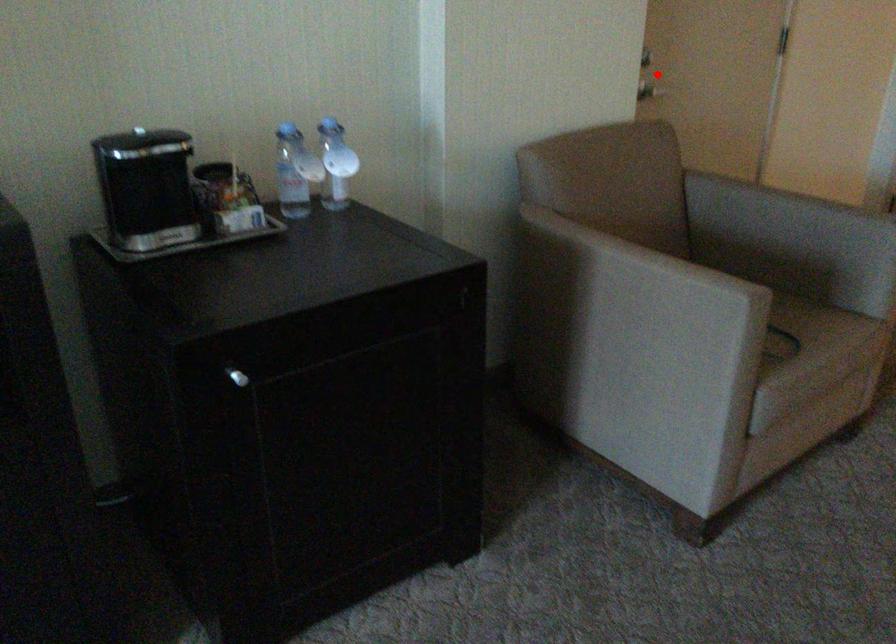
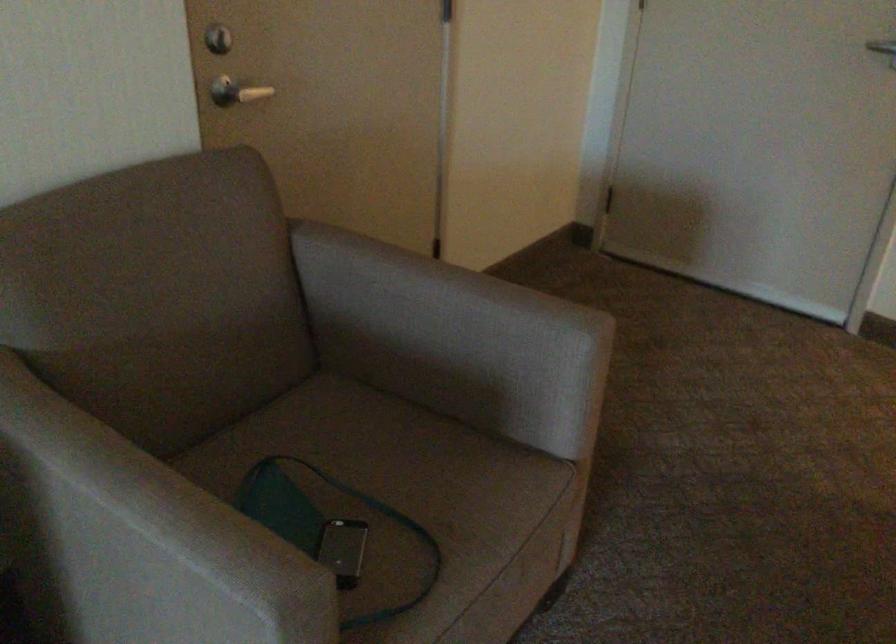
In the second image, find the point that corresponds to the highlighted location in the first image.

(236, 91)